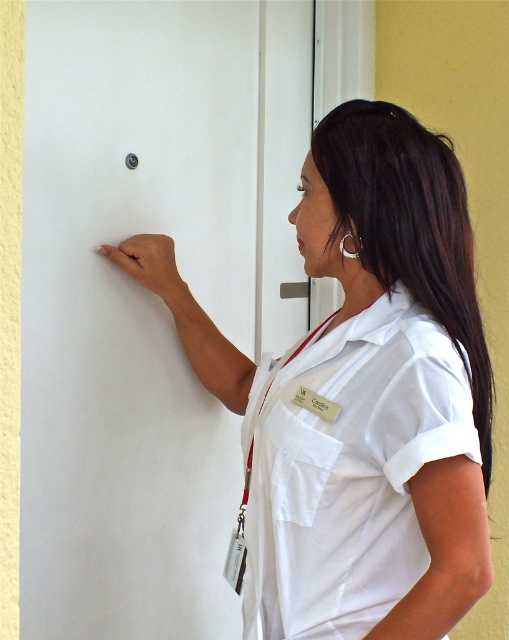
Is point (357, 170) positioned in front of point (297, 288)?

Yes, it is in front of point (297, 288).

Does white smooth shirt at center have a greater height compared to metallic silver door handle at center?

Yes.

Does point (448, 323) lie in front of point (308, 291)?

Yes, it is in front of point (308, 291).

You are a GUI agent. You are given a task and a screenshot of the screen. Output one action in this format:
    pyautogui.click(x=<x>, y=<y>)
    Task: Click on the white smooth shirt at center
    The width and height of the screenshot is (509, 640).
    Given the screenshot: What is the action you would take?
    pyautogui.click(x=360, y=396)

Is white matte door at center positioned in front of white smooth shirt at center?

That is False.

Can you confirm if white matte door at center is positioned above white smooth shirt at center?

Correct, white matte door at center is located above white smooth shirt at center.

Who is more distant from viewer, (268, 172) or (477, 320)?

The point (268, 172) is behind.

Locate an element on the screen. The width and height of the screenshot is (509, 640). white matte door at center is located at coordinates (148, 298).

Can you confirm if white matte door at center is positioned to the right of white smooth scrub at center?

In fact, white matte door at center is to the left of white smooth scrub at center.

Between point (19, 541) and point (313, 552), which one is positioned behind?

Positioned behind is point (19, 541).

Identify the location of white matte door at center. This screenshot has width=509, height=640. (148, 298).